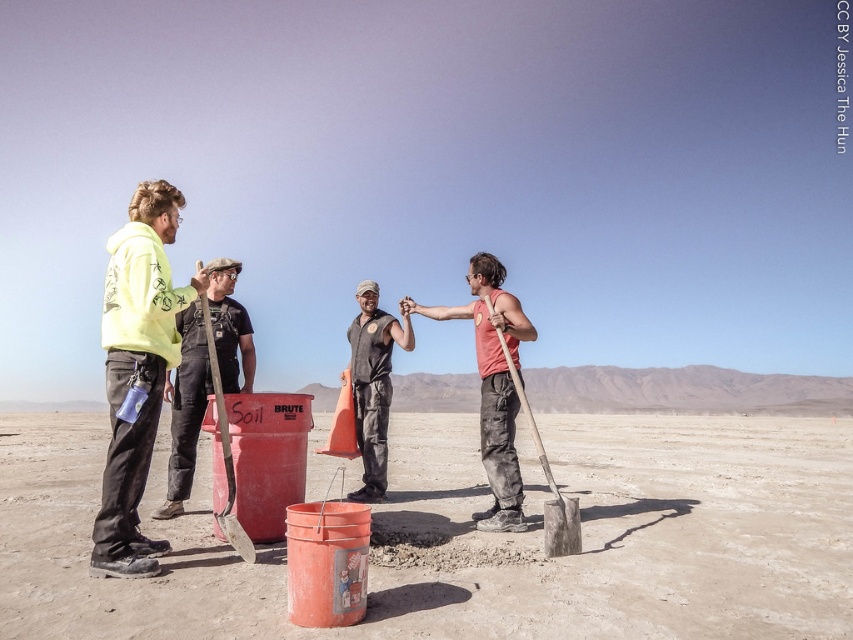
Question: Does black denim overalls at center come in front of dark gray uniform at center?

Choices:
 (A) no
 (B) yes

Answer: (B)

Question: Which object is closer to the camera taking this photo?

Choices:
 (A) matte red shirt at center
 (B) yellow hoodie at left
 (C) dark gray uniform at center
 (D) black denim overalls at center

Answer: (B)

Question: Which object is closer to the camera taking this photo?

Choices:
 (A) wooden shovel at right
 (B) black denim overalls at center
 (C) yellow hoodie at left
 (D) dirt field at center

Answer: (D)

Question: Considering the relative positions of dirt field at center and dark gray uniform at center in the image provided, where is dirt field at center located with respect to dark gray uniform at center?

Choices:
 (A) left
 (B) right

Answer: (B)

Question: Considering the relative positions of yellow hoodie at left and black denim overalls at center in the image provided, where is yellow hoodie at left located with respect to black denim overalls at center?

Choices:
 (A) right
 (B) left

Answer: (A)

Question: Which point is closer to the camera?

Choices:
 (A) yellow hoodie at left
 (B) matte red shirt at center
 (C) dirt field at center

Answer: (C)